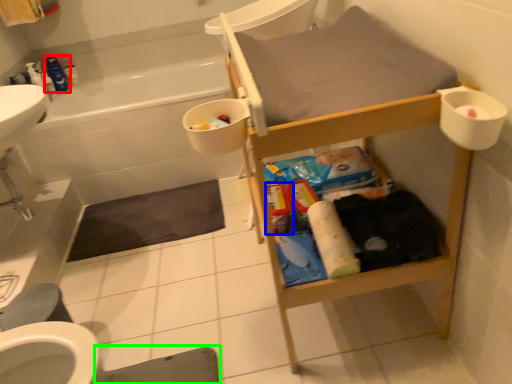
Question: Which object is positioned farthest from cleaning product (highlighted by a red box)? Select from toiletry (highlighted by a blue box) and bath mat (highlighted by a green box).

Choices:
 (A) toiletry
 (B) bath mat

Answer: (B)